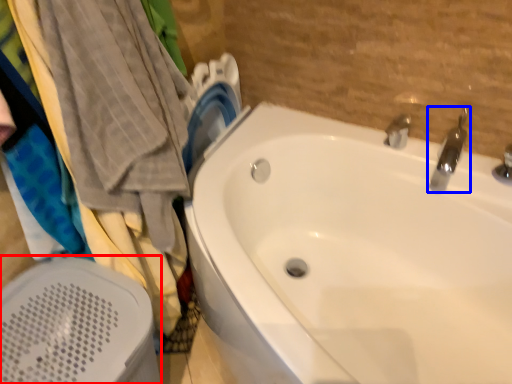
Question: Which point is further to the camera, bath heater (highlighted by a red box) or tap (highlighted by a blue box)?

Choices:
 (A) bath heater
 (B) tap

Answer: (B)